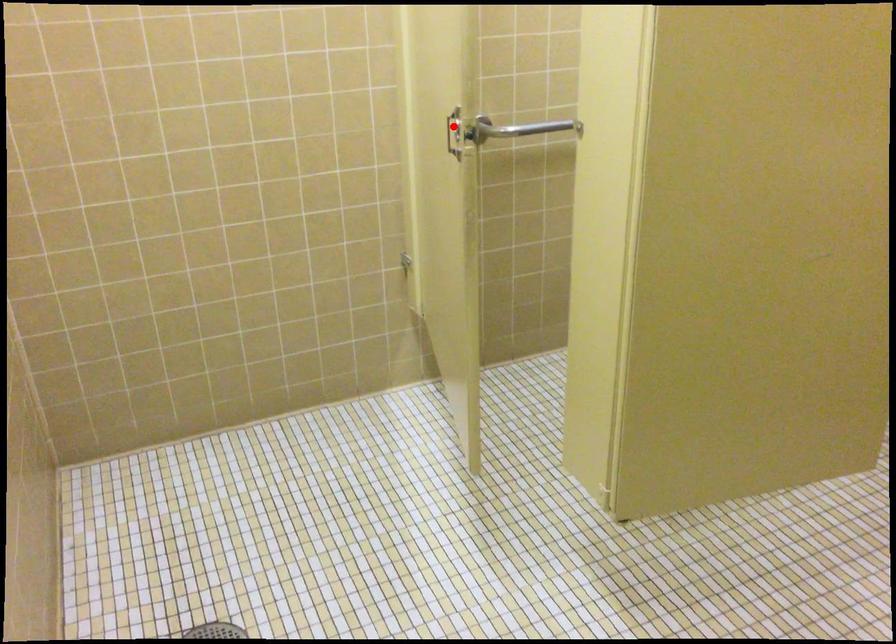
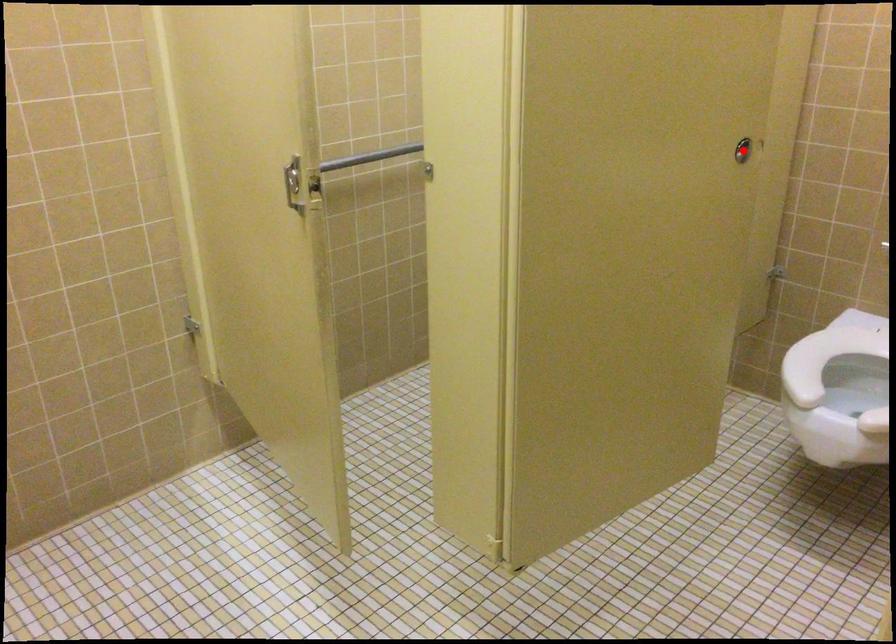
I am providing you with two images of the same scene from different viewpoints. A red point is marked on the first image and another point is marked on the second image. Do the highlighted points in image1 and image2 indicate the same real-world spot?

No